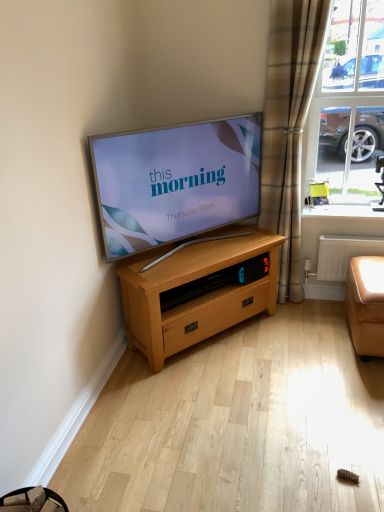
Where is `free point above white glossy window sill at upper right (from a real-world perspective)`? This screenshot has height=512, width=384. free point above white glossy window sill at upper right (from a real-world perspective) is located at coordinates (349, 202).